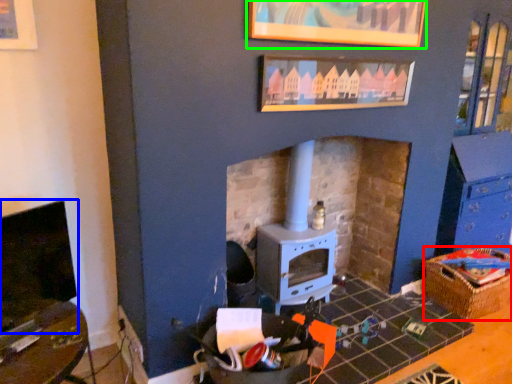
Question: Based on their relative distances, which object is nearer to crate (highlighted by a red box)? Choose from fireplace (highlighted by a blue box) and picture frame (highlighted by a green box).

Choices:
 (A) fireplace
 (B) picture frame

Answer: (B)